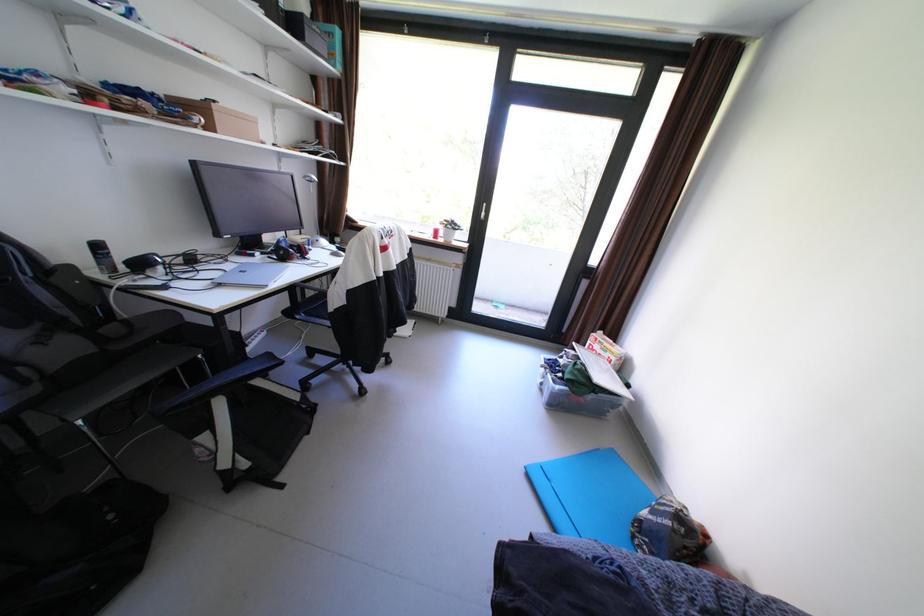
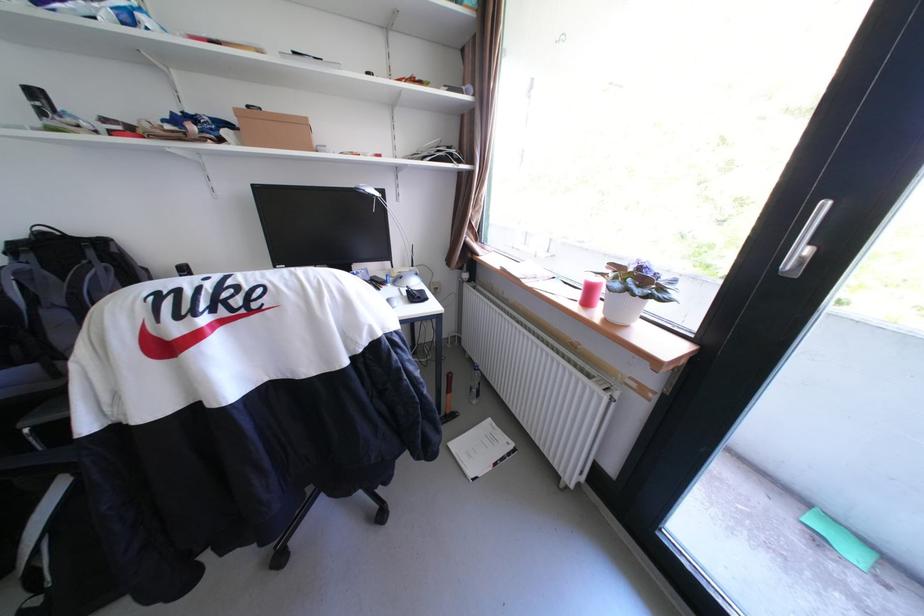
The point at (513, 307) is marked in the first image. Where is the corresponding point in the second image?

(867, 554)